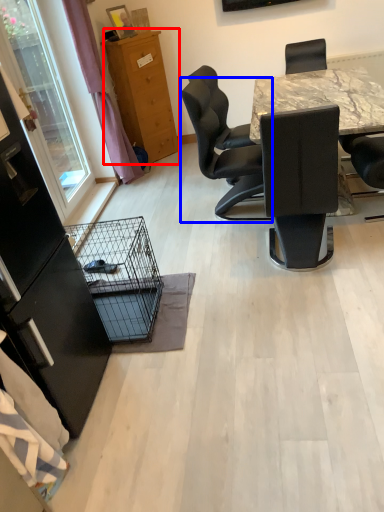
Question: Which of the following is the closest to the observer, cabinetry (highlighted by a red box) or chair (highlighted by a blue box)?

Choices:
 (A) cabinetry
 (B) chair

Answer: (B)